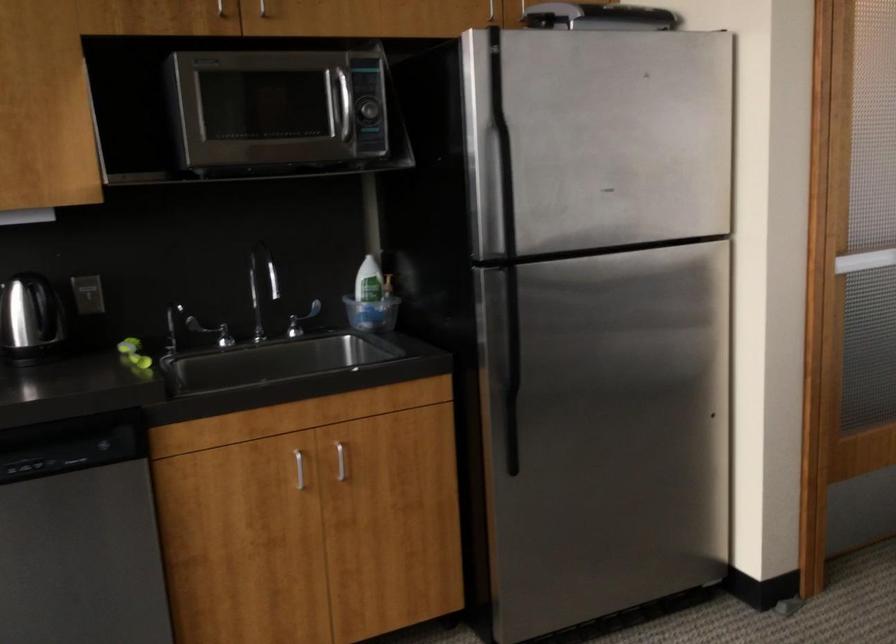
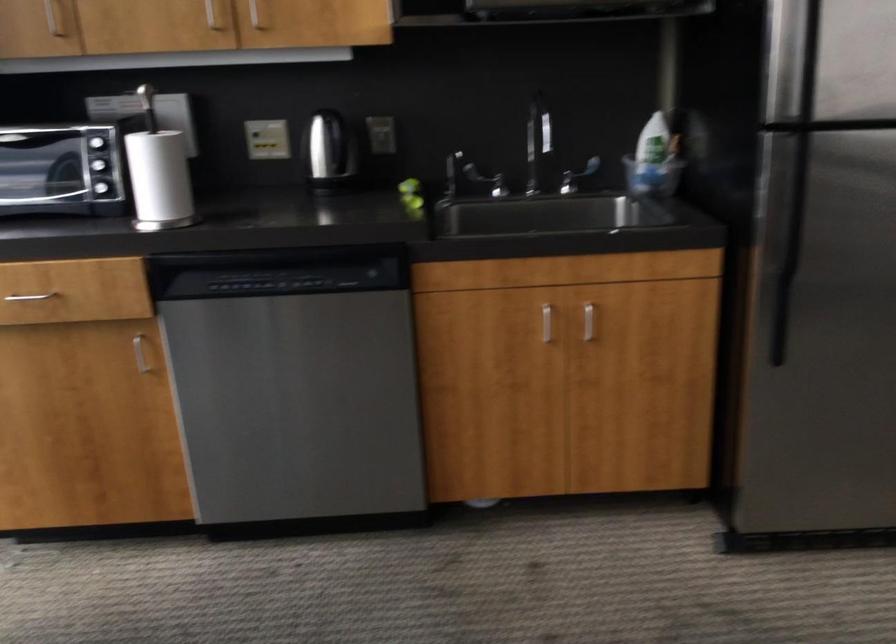
The point at [302,469] is marked in the first image. Where is the corresponding point in the second image?

(546, 323)